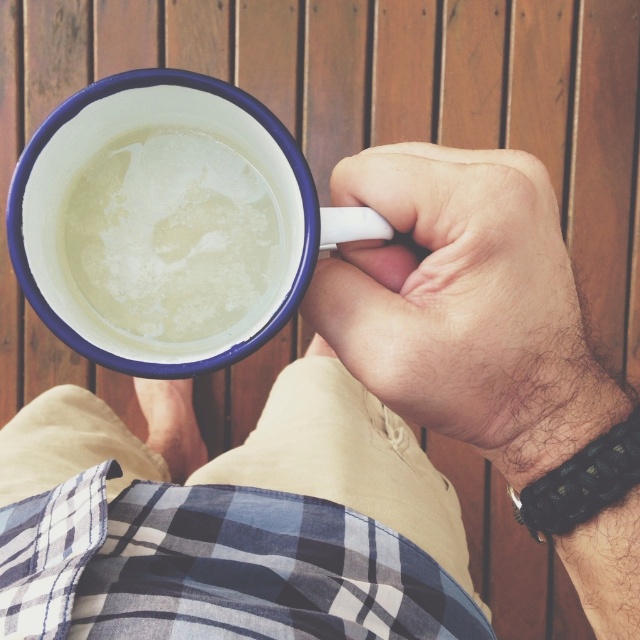
You are standing in front of the scene described. There is a point at coordinates (x=168, y=224). What object is located at that point?

The point at coordinates (x=168, y=224) corresponds to the white enamel mug at center.

You are a photographer trying to capture a close shot of the mug in the scene. The camera you are using has a focal length of 50mm and an aperture of f2.8. To ensure the mug is in focus, you need to know the distance between the camera and the point at coordinates point (291, 275). Can you provide this distance?

The distance between the camera and the point at coordinates point (291, 275) is 16.62 inches, so the photographer should set the focus at that distance to ensure the mug is sharp.

You are a barista trying to place the white enamel mug at center on a shelf that can only hold items smaller than the matte white hand at center. Can the mug fit on the shelf?

The white enamel mug at center is larger in size than the matte white hand at center, so it cannot fit on the shelf that has a size limit based on the matte white hand at center.